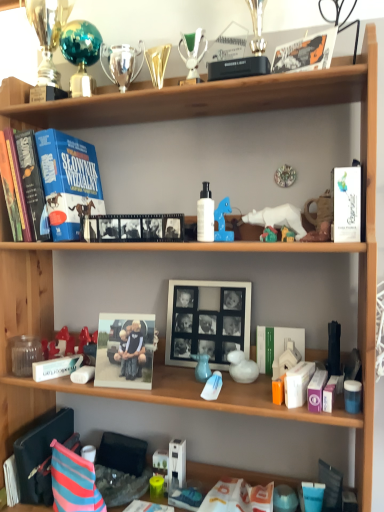
Question: Considering the relative sizes of matte plastic photo frame at center, the second picture frame positioned from the right, and white glossy duck at center, the 6th toy viewed from the left, in the image provided, is matte plastic photo frame at center, the second picture frame positioned from the right, thinner than white glossy duck at center, the 6th toy viewed from the left,?

Choices:
 (A) yes
 (B) no

Answer: (A)

Question: Considering the relative sizes of matte plastic photo frame at center, marked as the 1th picture frame in a left-to-right arrangement, and white glossy duck at center, positioned as the third toy in bottom-to-top order, in the image provided, is matte plastic photo frame at center, marked as the 1th picture frame in a left-to-right arrangement, smaller than white glossy duck at center, positioned as the third toy in bottom-to-top order,?

Choices:
 (A) no
 (B) yes

Answer: (A)

Question: Is matte plastic photo frame at center, which ranks as the first picture frame in front-to-back order, not near white glossy duck at center, positioned as the third toy in bottom-to-top order?

Choices:
 (A) yes
 (B) no

Answer: (B)

Question: Is white glossy duck at center, positioned as the third toy in bottom-to-top order, completely or partially inside matte plastic photo frame at center, marked as the 1th picture frame in a left-to-right arrangement?

Choices:
 (A) no
 (B) yes

Answer: (A)

Question: Considering the relative positions of matte plastic photo frame at center, the 2th picture frame in the back-to-front sequence, and white glossy duck at center, positioned as the third toy in bottom-to-top order, in the image provided, is matte plastic photo frame at center, the 2th picture frame in the back-to-front sequence, to the right of white glossy duck at center, positioned as the third toy in bottom-to-top order, from the viewer's perspective?

Choices:
 (A) yes
 (B) no

Answer: (B)

Question: Is matte plastic photo frame at center, the 2th picture frame in the back-to-front sequence, turned away from white glossy duck at center, the fourth toy viewed from the top?

Choices:
 (A) no
 (B) yes

Answer: (A)

Question: Can you confirm if shiny teal ball at upper left, marked as the sixth toy in a bottom-to-top arrangement, is shorter than matte plastic photo frame at center, which ranks as the first picture frame in front-to-back order?

Choices:
 (A) no
 (B) yes

Answer: (A)

Question: From the image's perspective, is shiny teal ball at upper left, the first toy positioned from the left, located beneath matte plastic photo frame at center, marked as the 1th picture frame in a left-to-right arrangement?

Choices:
 (A) yes
 (B) no

Answer: (B)

Question: Is shiny teal ball at upper left, the first toy positioned from the left, behind matte plastic photo frame at center, the 2th picture frame in the back-to-front sequence?

Choices:
 (A) yes
 (B) no

Answer: (A)

Question: Considering the relative positions of shiny teal ball at upper left, acting as the 6th toy starting from the right, and matte plastic photo frame at center, which ranks as the first picture frame in front-to-back order, in the image provided, is shiny teal ball at upper left, acting as the 6th toy starting from the right, to the left of matte plastic photo frame at center, which ranks as the first picture frame in front-to-back order, from the viewer's perspective?

Choices:
 (A) no
 (B) yes

Answer: (B)

Question: From the image's perspective, would you say shiny teal ball at upper left, acting as the 6th toy starting from the right, is positioned over matte plastic photo frame at center, marked as the 1th picture frame in a left-to-right arrangement?

Choices:
 (A) yes
 (B) no

Answer: (A)

Question: From a real-world perspective, is shiny teal ball at upper left, the first toy positioned from the left, over matte plastic photo frame at center, the 2th picture frame in the back-to-front sequence?

Choices:
 (A) yes
 (B) no

Answer: (A)

Question: Is white glossy book at upper right, the 4th magazine in the back-to-front sequence, at the right side of black plastic magazine at lower left, the second magazine positioned from the back?

Choices:
 (A) yes
 (B) no

Answer: (A)